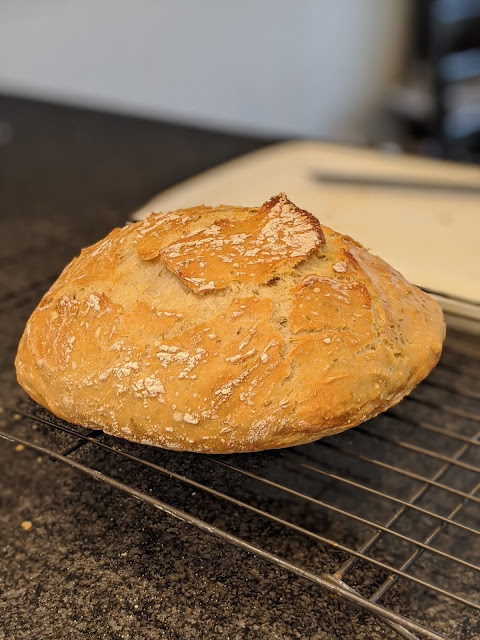
Locate an element on the screen. The width and height of the screenshot is (480, 640). table is located at coordinates (136, 575), (208, 614), (119, 607), (50, 572), (68, 528), (235, 577), (54, 205), (78, 176).